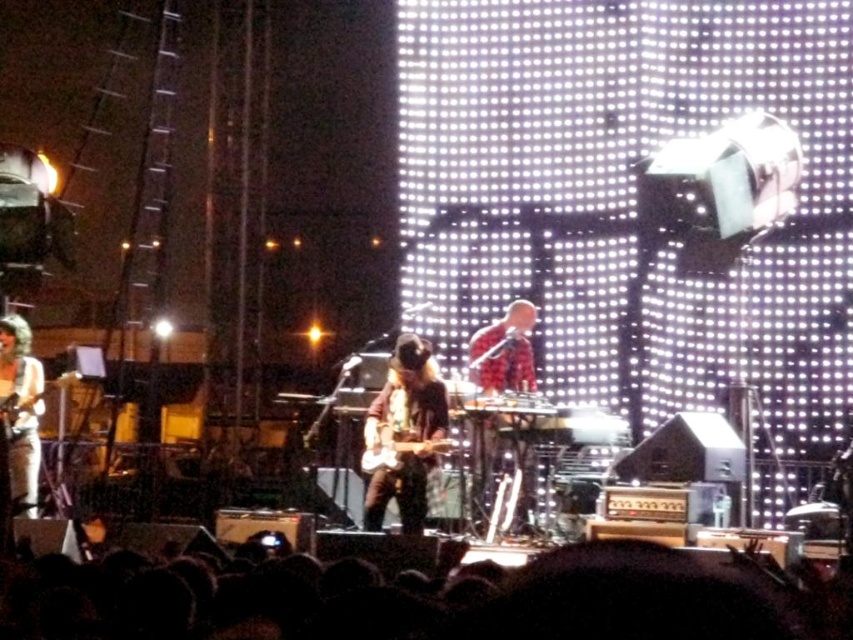
You are a photographer at the concert and want to capture a clear shot of both the black hair at lower center and the shiny black guitar at center. Which object is closer to the camera, allowing you to focus on it first?

The black hair at lower center is closer to the camera than the shiny black guitar at center because it has a lesser height, meaning it is positioned nearer in the frame.

You are a photographer at the concert and want to capture a photo that includes both the black hair at lower center and the red plaid shirt at center. Based on their positions, which one should you adjust your camera focus to first to ensure both are in the frame?

The black hair at lower center is positioned on the left side of the red plaid shirt at center, so you should focus on the red plaid shirt at center first to ensure both are included in the frame.